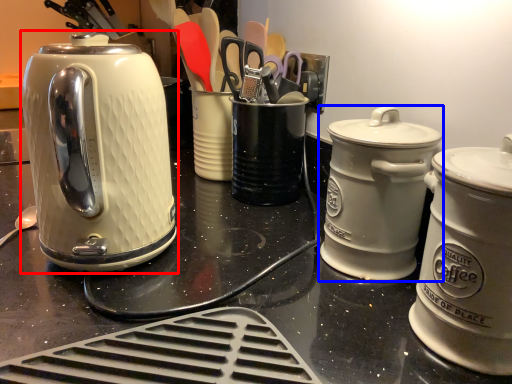
Question: Which point is closer to the camera, kettle (highlighted by a red box) or kitchen appliance (highlighted by a blue box)?

Choices:
 (A) kettle
 (B) kitchen appliance

Answer: (A)